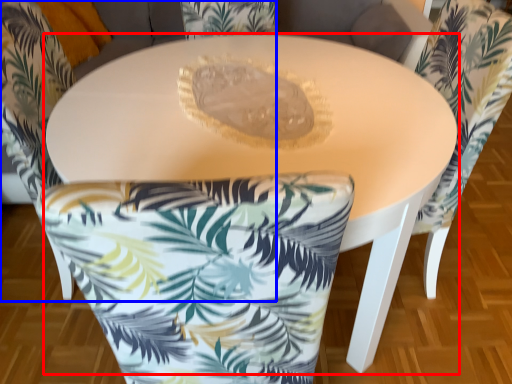
Question: Which object appears farthest to the camera in this image, table (highlighted by a red box) or chair (highlighted by a blue box)?

Choices:
 (A) table
 (B) chair

Answer: (B)